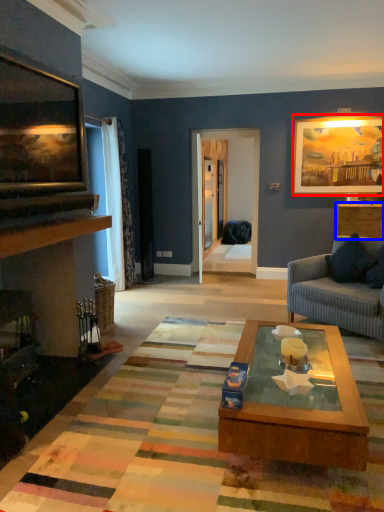
Question: Which of the following is the farthest to the observer, picture frame (highlighted by a red box) or cabinetry (highlighted by a blue box)?

Choices:
 (A) picture frame
 (B) cabinetry

Answer: (A)